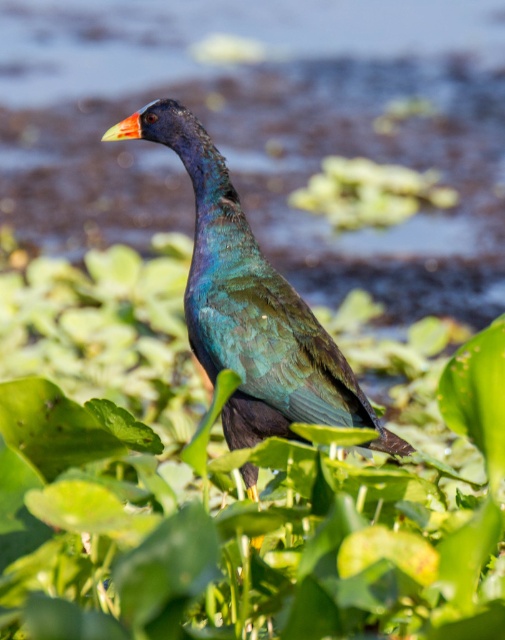
Question: Does green leafy plant at center have a lesser width compared to metallic iridescent bird at center?

Choices:
 (A) yes
 (B) no

Answer: (B)

Question: Which point is farther to the camera?

Choices:
 (A) (80, 465)
 (B) (261, 401)

Answer: (B)

Question: Is green leafy plant at center smaller than metallic iridescent bird at center?

Choices:
 (A) no
 (B) yes

Answer: (A)

Question: Which of the following is the closest to the observer?

Choices:
 (A) green leafy plant at center
 (B) metallic iridescent bird at center

Answer: (B)

Question: Is green leafy plant at center positioned before metallic iridescent bird at center?

Choices:
 (A) no
 (B) yes

Answer: (A)